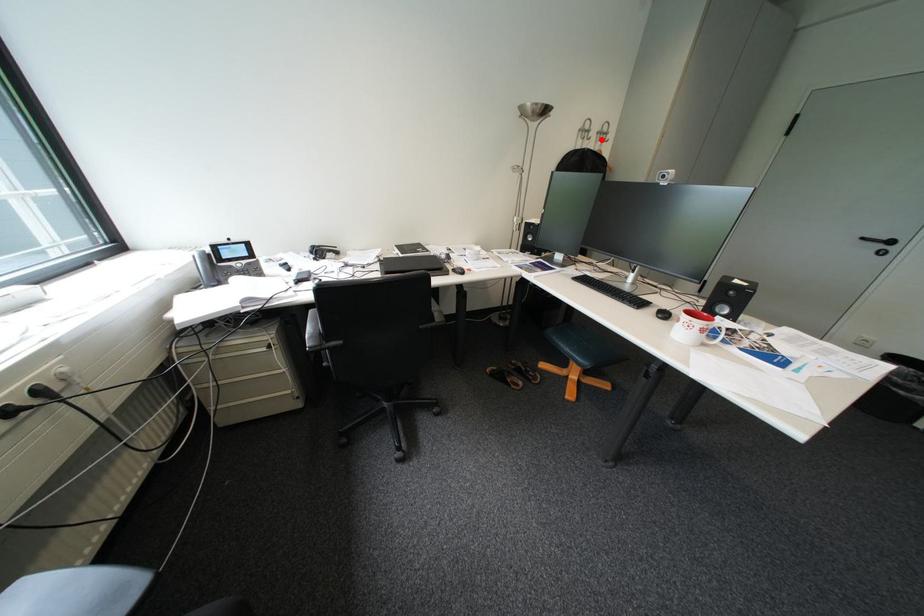
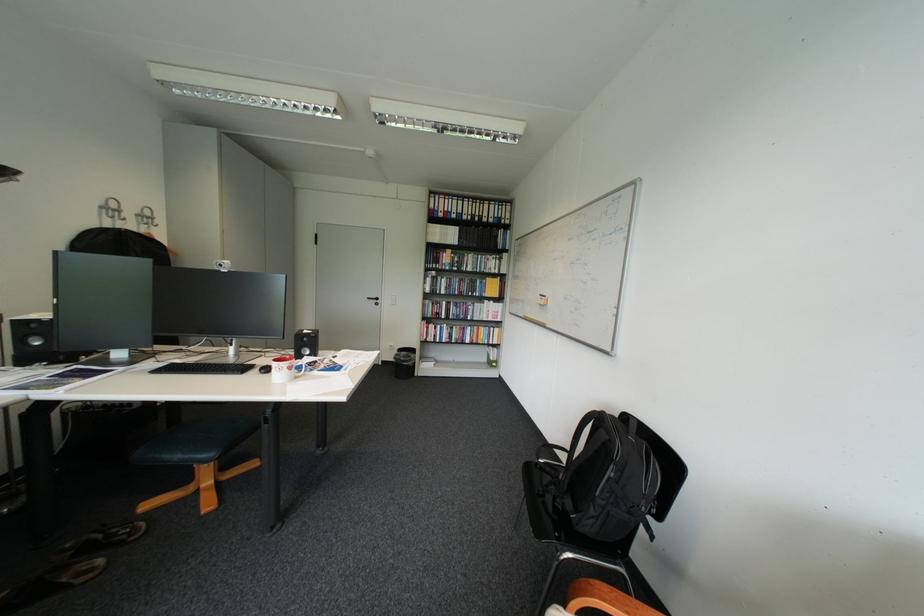
Question: A red point is marked in image1. In image2, is the corresponding 3D point closer to the camera or farther? Reply with the corresponding letter.

Choices:
 (A) The corresponding 3D point is closer.
 (B) The corresponding 3D point is farther.

Answer: (B)